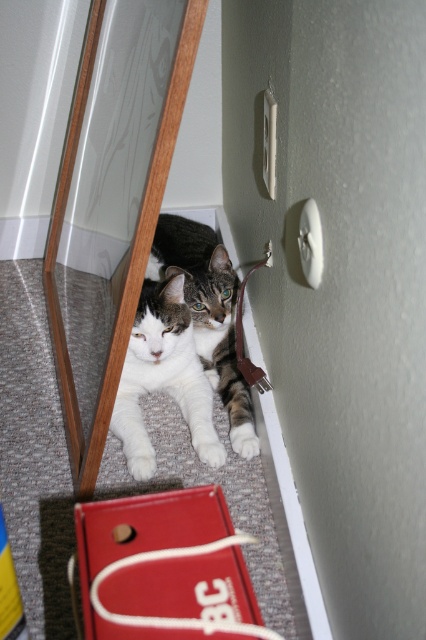
You are standing in the room and see the red box with white text and a white handle. There is a point marked at coordinates (164, 378). What object or feature does this point correspond to?

The point at coordinates (164, 378) corresponds to the white fur tabby cat at lower left.

You are a photographer setting up a shoot in this room. You need to place a tripod so that it doesn not block the wooden mirror at center or the white fur cat at lower left. Where should you position the tripod to ensure both are visible in the frame?

The wooden mirror at center is positioned over the white fur cat at lower left, so placing the tripod between them or slightly behind the cat would keep both in view without obstruction.